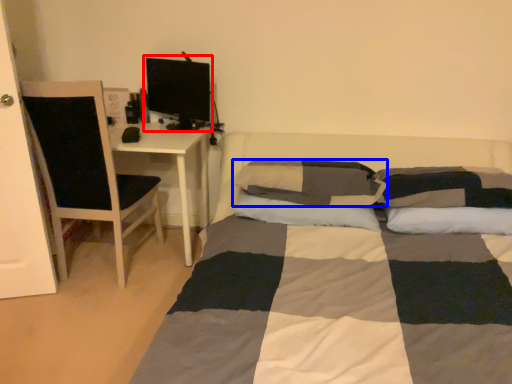
Question: Which object appears farthest to the camera in this image, computer monitor (highlighted by a red box) or pillow (highlighted by a blue box)?

Choices:
 (A) computer monitor
 (B) pillow

Answer: (A)